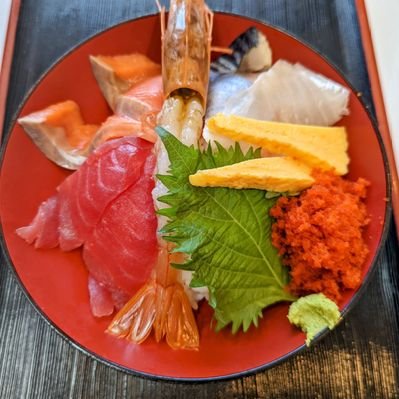
Identify the location of table. The image size is (399, 399). (41, 371), (354, 371), (338, 31), (65, 27).